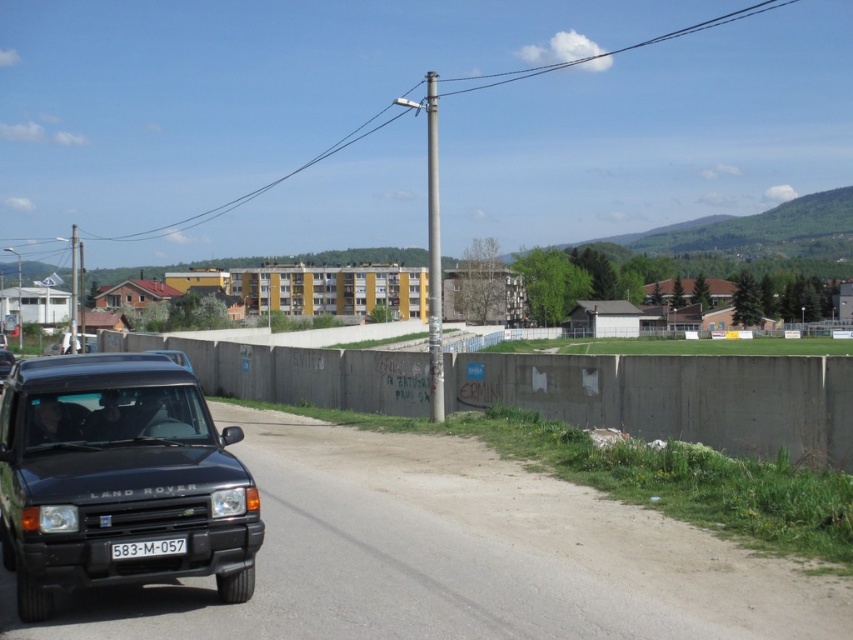
Question: Which object is the closest to the white plastic license plate at lower center?

Choices:
 (A) black matte suv at lower left
 (B) concrete wall at center

Answer: (A)

Question: Is concrete wall at center bigger than white plastic license plate at lower center?

Choices:
 (A) yes
 (B) no

Answer: (A)

Question: Is black matte suv at lower left above white plastic license plate at lower center?

Choices:
 (A) yes
 (B) no

Answer: (A)

Question: Is concrete wall at center to the right of white plastic license plate at lower center from the viewer's perspective?

Choices:
 (A) yes
 (B) no

Answer: (B)

Question: Which of the following is the farthest from the observer?

Choices:
 (A) white plastic license plate at lower center
 (B) concrete wall at center
 (C) black matte suv at lower left

Answer: (B)

Question: Which object is positioned closest to the black matte suv at lower left?

Choices:
 (A) concrete wall at center
 (B) white plastic license plate at lower center

Answer: (B)